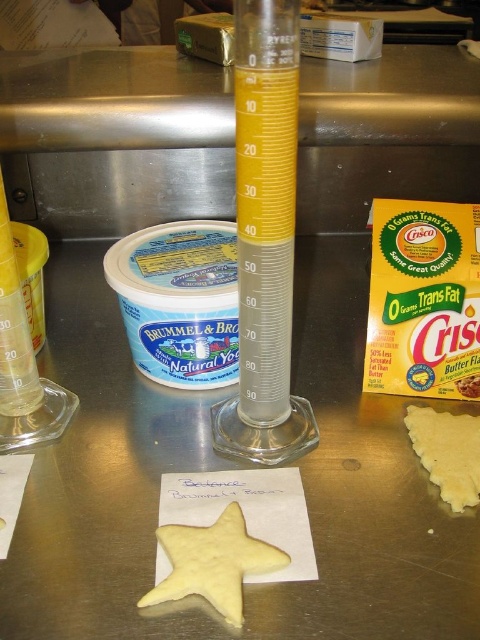
You are standing at the kitchen counter and need to reach two points marked on the countertop. The first point is at coordinates point (434, 448) and the second is at point (468, 397). Which point will you reach first if you move directly toward them from your current position?

Point (434, 448) is in front of point (468, 397), so you will reach point (434, 448) first.